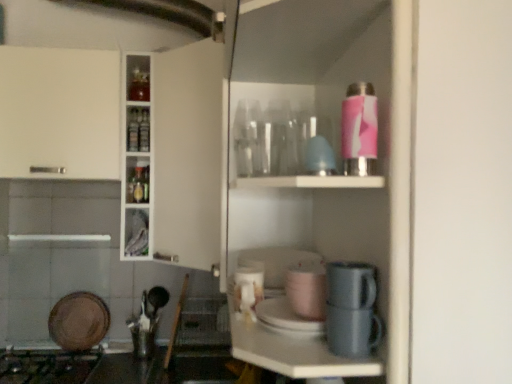
Question: From the image's perspective, is matte pink cup at center, positioned as the second appliance in top-to-bottom order, below matte gray mug at lower center, marked as the 1th appliance in a front-to-back arrangement?

Choices:
 (A) no
 (B) yes

Answer: (B)

Question: From a real-world perspective, does matte pink cup at center, positioned as the 3th appliance in left-to-right order, stand above matte gray mug at lower center, marked as the 1th appliance in a front-to-back arrangement?

Choices:
 (A) no
 (B) yes

Answer: (A)

Question: From a real-world perspective, is matte pink cup at center, positioned as the second appliance in top-to-bottom order, positioned under matte gray mug at lower center, the first appliance from the right, based on gravity?

Choices:
 (A) no
 (B) yes

Answer: (B)

Question: Does matte pink cup at center, marked as the third appliance in a bottom-to-top arrangement, have a larger size compared to matte gray mug at lower center, marked as the 1th appliance in a front-to-back arrangement?

Choices:
 (A) yes
 (B) no

Answer: (A)

Question: Does matte pink cup at center, positioned as the 3th appliance in left-to-right order, lie in front of matte gray mug at lower center, the first appliance from the right?

Choices:
 (A) no
 (B) yes

Answer: (A)

Question: In terms of size, does metallic gray coffee machine at lower center appear bigger or smaller than black matte gas stove at lower left?

Choices:
 (A) small
 (B) big

Answer: (A)

Question: Does point (342, 263) appear closer or farther from the camera than point (22, 365)?

Choices:
 (A) farther
 (B) closer

Answer: (B)

Question: Considering the positions of metallic gray coffee machine at lower center and black matte gas stove at lower left in the image, is metallic gray coffee machine at lower center taller or shorter than black matte gas stove at lower left?

Choices:
 (A) tall
 (B) short

Answer: (B)

Question: Which is correct: metallic gray coffee machine at lower center is inside black matte gas stove at lower left, or outside of it?

Choices:
 (A) outside
 (B) inside

Answer: (A)

Question: Is metallic gray coffee machine at lower center bigger or smaller than matte gray mug at lower center, marked as the 1th appliance in a front-to-back arrangement?

Choices:
 (A) small
 (B) big

Answer: (A)

Question: Do you think metallic gray coffee machine at lower center is within matte gray mug at lower center, marked as the 1th appliance in a front-to-back arrangement, or outside of it?

Choices:
 (A) inside
 (B) outside

Answer: (B)

Question: From a real-world perspective, relative to matte gray mug at lower center, which is counted as the 4th appliance, starting from the back, is metallic gray coffee machine at lower center vertically above or below?

Choices:
 (A) above
 (B) below

Answer: (B)

Question: Relative to matte gray mug at lower center, which is the 4th appliance from bottom to top, is metallic gray coffee machine at lower center in front or behind?

Choices:
 (A) front
 (B) behind

Answer: (B)

Question: From their relative heights in the image, would you say matte pink cup at center, positioned as the second appliance in top-to-bottom order, is taller or shorter than black matte gas stove at lower left?

Choices:
 (A) tall
 (B) short

Answer: (B)

Question: From the image's perspective, is matte pink cup at center, positioned as the second appliance in front-to-back order, located above or below black matte gas stove at lower left?

Choices:
 (A) below
 (B) above

Answer: (B)